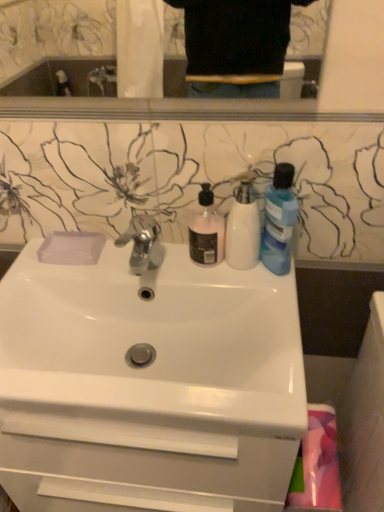
This screenshot has width=384, height=512. In order to click on free spot in front of pink matte liquid soap at center, which is the 3th cleaning product from right to left in this screenshot , I will do `click(233, 288)`.